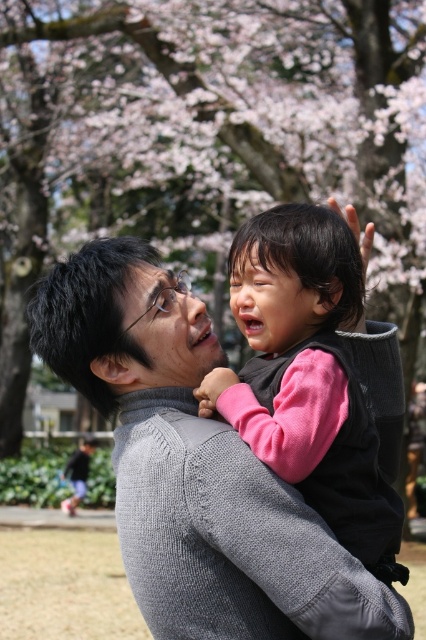
You are a photographer trying to capture the child in the pink fleece vest at center. You notice the smooth pink blossoms at upper center might block the view. Which object is more to the left, making it potentially obstruct the vest?

The smooth pink blossoms at upper center is positioned on the left side of the pink fleece vest at center, so it is more to the left and could obstruct the view of the vest.

You are standing in the park and want to take a photo of the smooth pink blossoms at upper center and the gray knitted sweater at center. The camera you have can focus on objects within 50 feet. Will both objects be in focus?

The smooth pink blossoms at upper center is 57.01 feet away from gray knitted sweater at center. Since the blossoms are more than 50 feet away from the sweater, and the camera can only focus within 50 feet, the blossoms will be out of focus while the sweater might be in focus. However, if the camera is positioned such that both are within 50 feet individually from the camera, they could both be in focus. But based on their separation distance, it might not be possible.